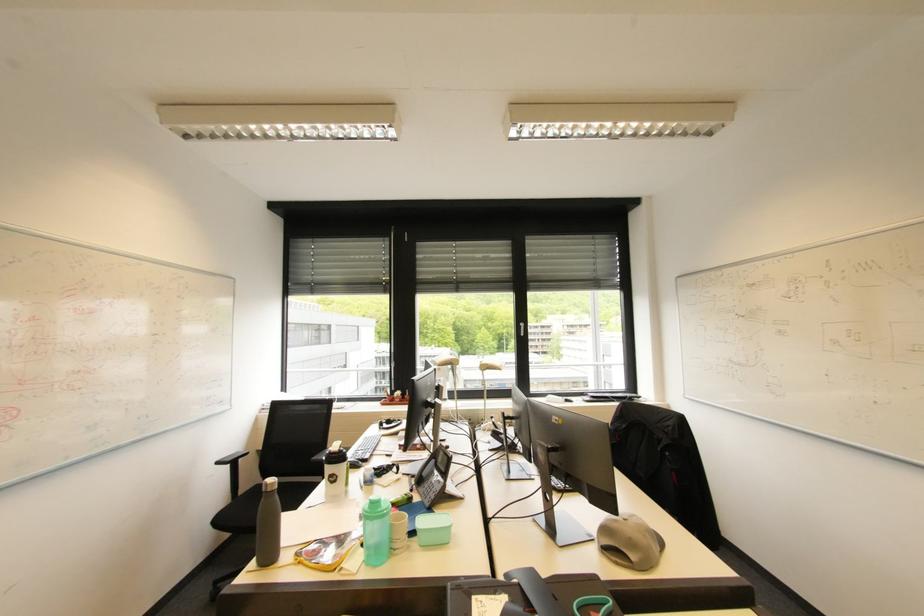
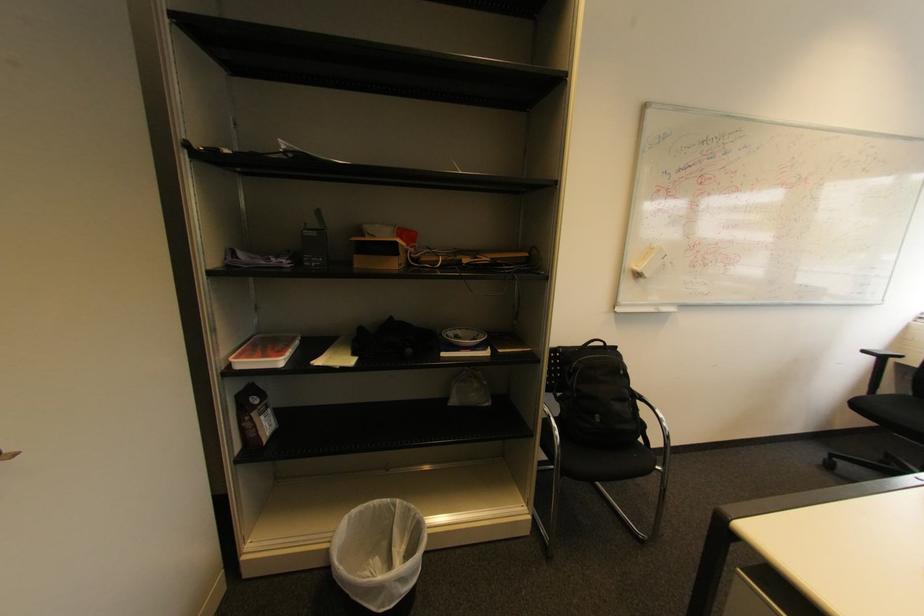
In the second image, find the point that corresponds to the point at 225,522 in the first image.

(861, 406)